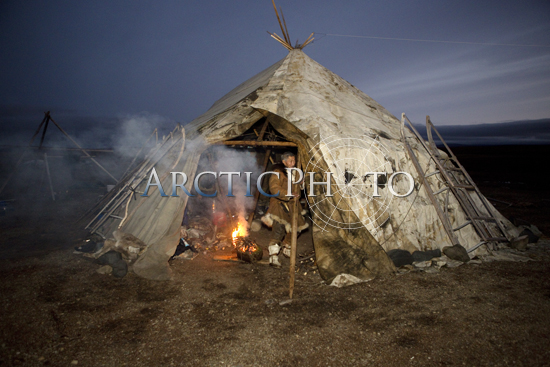
Locate an element on the screen. Image resolution: width=550 pixels, height=367 pixels. supporting poles is located at coordinates (297, 284), (264, 140), (284, 37).